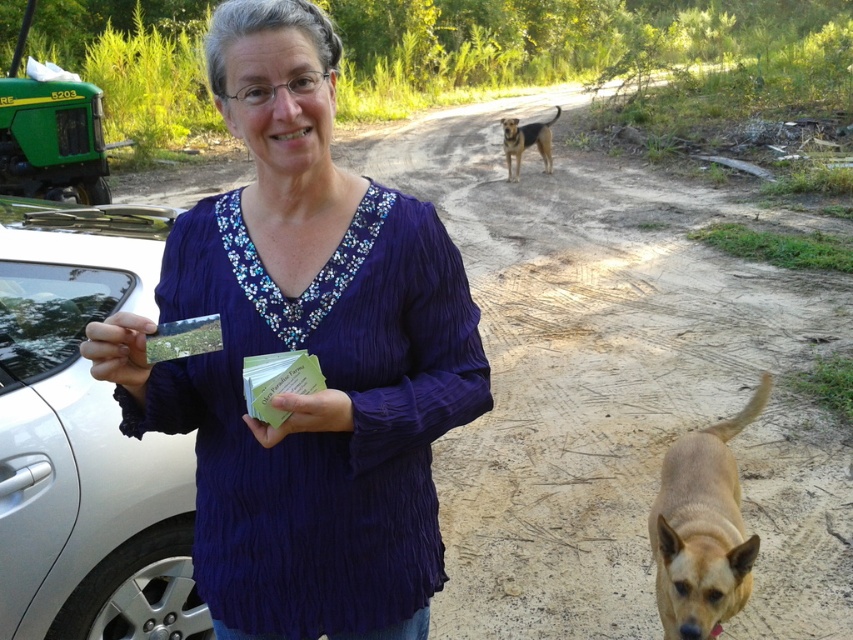
You are a photographer taking a portrait of the woman in the scene. You need to ensure that both the purple crinkled shirt at center and the matte plastic card at lower left are clearly visible in the photo. Which object should you focus on to ensure both are in focus, considering their sizes?

The purple crinkled shirt at center is larger than the matte plastic card at lower left, so focusing on the purple crinkled shirt at center will ensure both objects are within the depth of field and in focus.

You are a photographer positioned at the scene. You notice the silver metallic car at lower left and the green paper packet at center. Which object is closer to your camera lens?

The silver metallic car at lower left is closer to the camera lens because it is further to the viewer than the green paper packet at center.